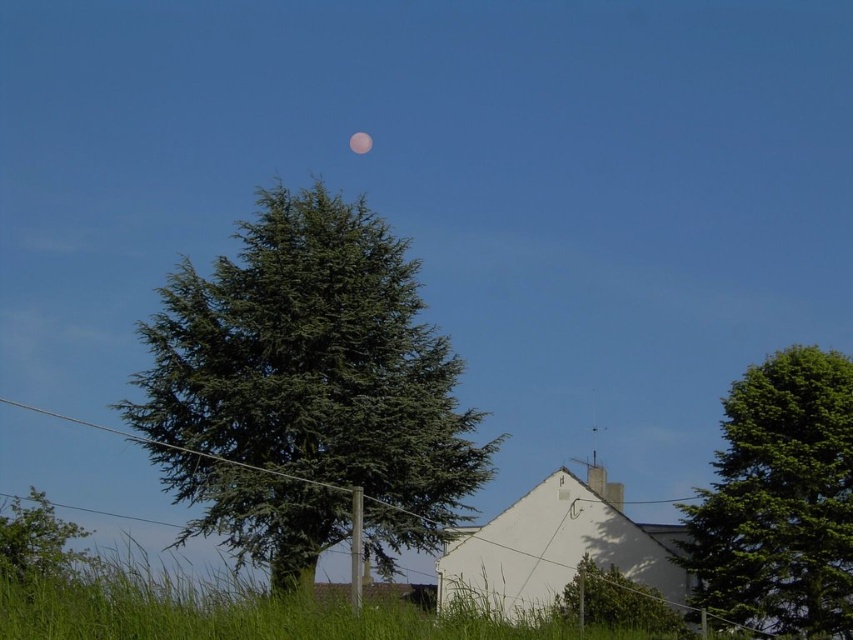
You are an astronomer observing the night sky and notice the green leafy tree at lower left and the pink translucent moon at upper center. Which object appears bigger in the image?

The green leafy tree at lower left appears bigger than the pink translucent moon at upper center in the image.

From the picture: You are an astronaut on the moon who wants to take a photo of the green leafy tree at lower left and the pink translucent moon at upper center. Which object should you focus on first to ensure both are in sharp focus?

You should focus on the green leafy tree at lower left first because it is closer to the viewer than the pink translucent moon at upper center, so adjusting focus from near to far will help both be in sharp focus.

You are standing in the middle of the rural area shown in the image. You see the green leafy tree at right and the green leafy tree at lower left. Which direction should you walk to get closer to the tree that is positioned to the right of the other tree?

You should walk towards the right direction because the green leafy tree at right is to the right of the green leafy tree at lower left, so moving right will bring you closer to it.